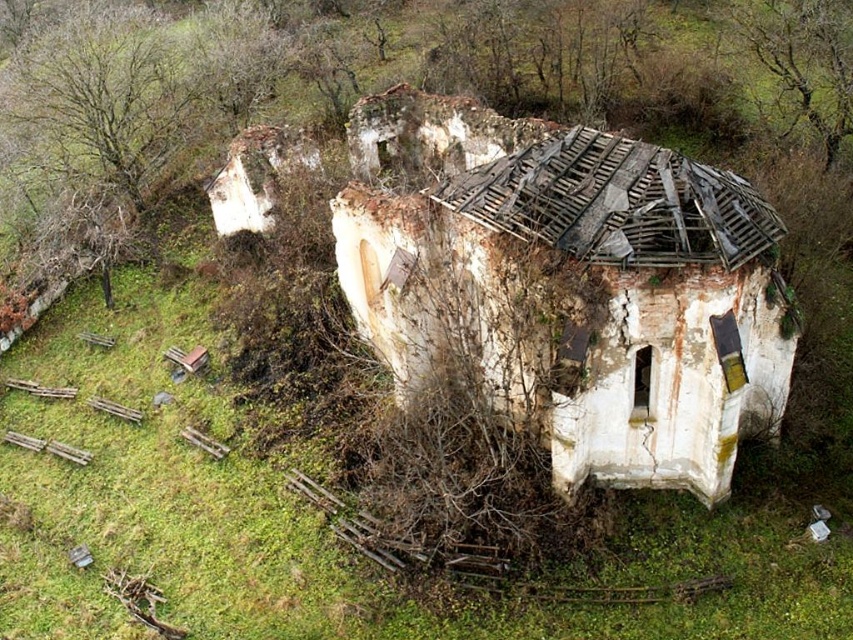
You are a drone operator flying over a rural area. Your drone is currently above the white cracked stone hut at center. You want to locate the brown textured tree at upper right. In which direction should you direct the drone to fly?

The white cracked stone hut at center is to the left of brown textured tree at upper right, so you should direct the drone to fly to the right to locate the brown textured tree at upper right.